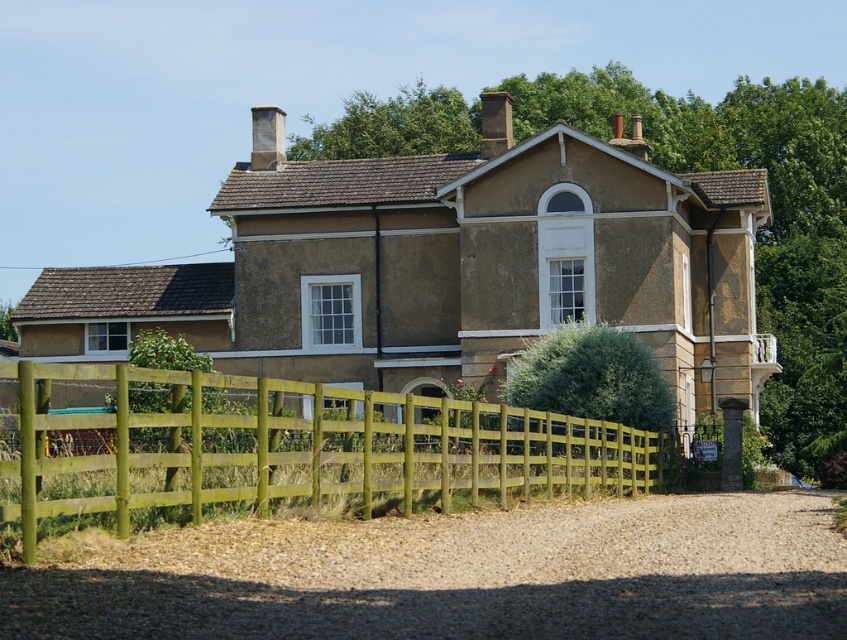
You are a delivery person approaching the house and need to park your vehicle. The gravelly dirt driveway at lower center and the green wooden fence at lower center are in your path. Which object must you navigate around first?

The gravelly dirt driveway at lower center is in front of the green wooden fence at lower center, so you must navigate around the gravelly dirt driveway at lower center first before encountering the green wooden fence at lower center.

You are a delivery person trying to park your van in the driveway. The van is 6 meters long. Can you fit your van completely on the gravelly dirt driveway at lower center if the driveway is smaller than the green wooden fence at lower center?

The gravelly dirt driveway at lower center has a smaller size compared to the green wooden fence at lower center. However, the exact dimensions of the driveway are not provided, so it is uncertain whether the 6 meter van can fit. More information about the driveway size is needed to determine this.